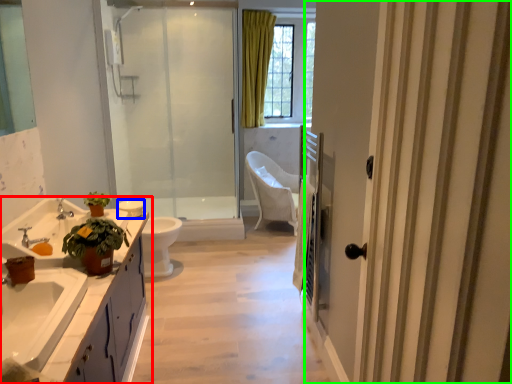
Question: Which object is the farthest from bathroom cabinet (highlighted by a red box)? Choose among these: toilet bowl (highlighted by a blue box) or door (highlighted by a green box).

Choices:
 (A) toilet bowl
 (B) door

Answer: (B)